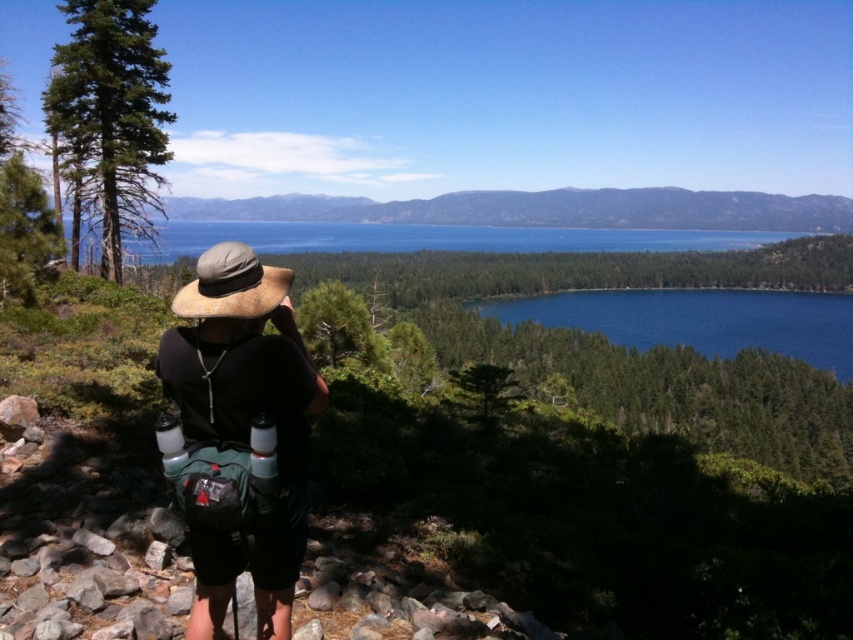
You are standing at the point labeled point (207, 278) and want to walk towards the point labeled point (277, 236). According to the scene description, will you be moving towards or away from the distant mountains?

Since point (207, 278) is in front of point (277, 236), moving from point (207, 278) to point (277, 236) means you are moving away from the distant mountains.